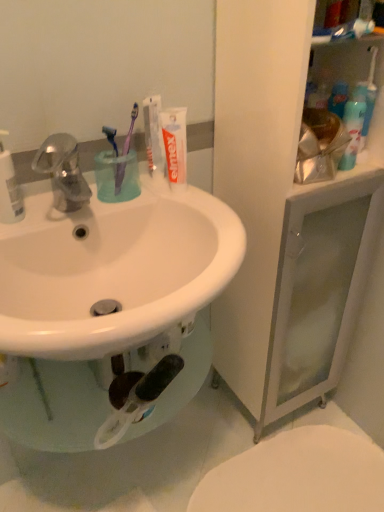
Where is `free space on the front side of purple plastic toothbrush at upper center, placed as the first toothbrush when sorted from left to right`? This screenshot has width=384, height=512. free space on the front side of purple plastic toothbrush at upper center, placed as the first toothbrush when sorted from left to right is located at coordinates (92, 205).